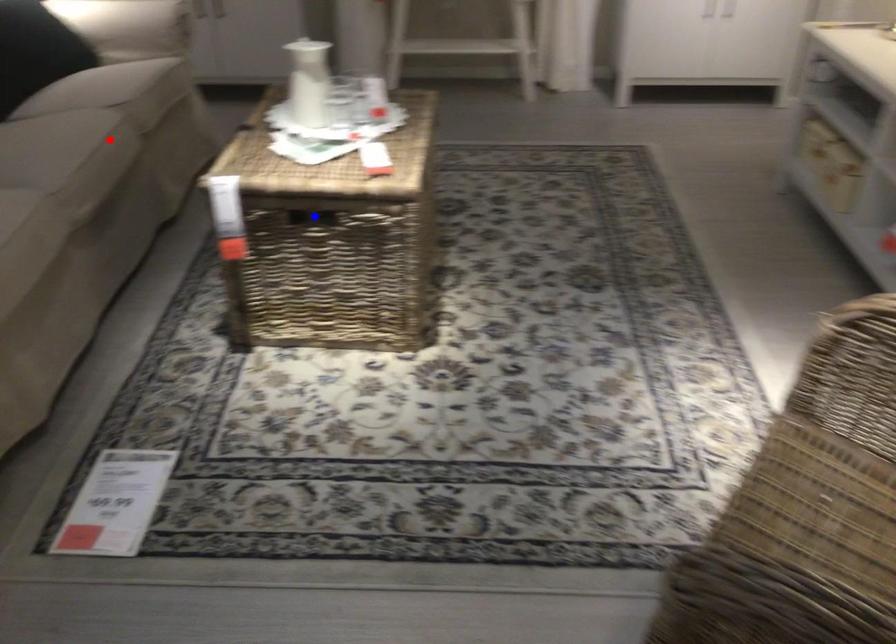
Question: Which of the two points in the image is closer to the camera?

Choices:
 (A) Blue point is closer.
 (B) Red point is closer.

Answer: (A)